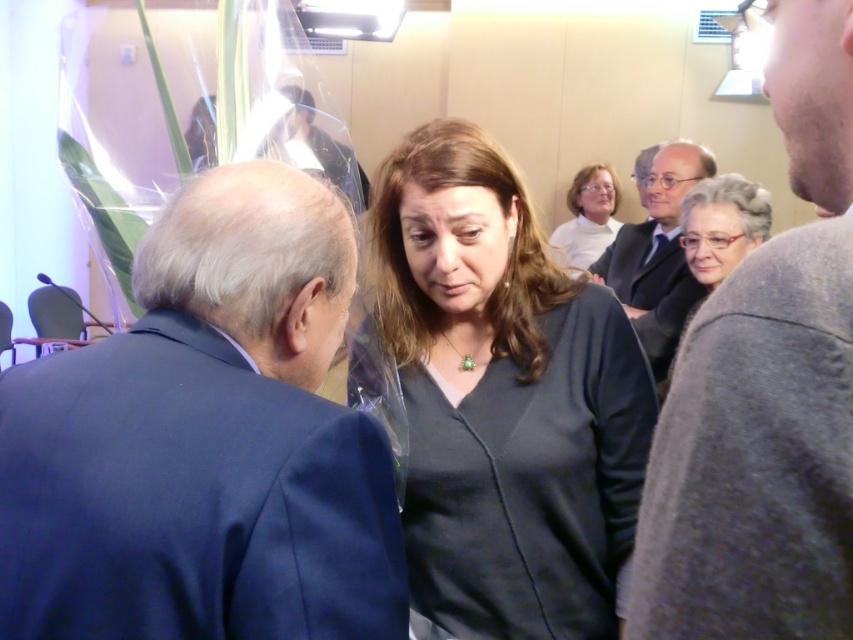
You are standing in the conference room and need to locate the dark blue suit at left. According to the coordinate system where the bottom left corner is the origin, can you confirm its position?

The dark blue suit at left is located at the 2D coordinates of point (206,442).

You are attending a formal event and want to know which clothing item is taller between the matte black shirt at center and the gray woolen sweater at upper right. Can you tell me?

The matte black shirt at center is taller than the gray woolen sweater at upper right according to the description.